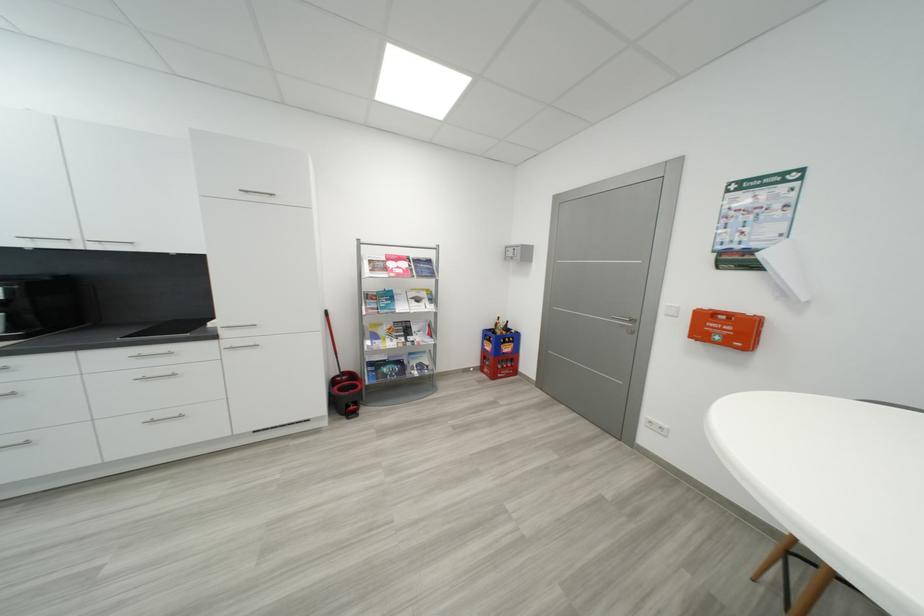
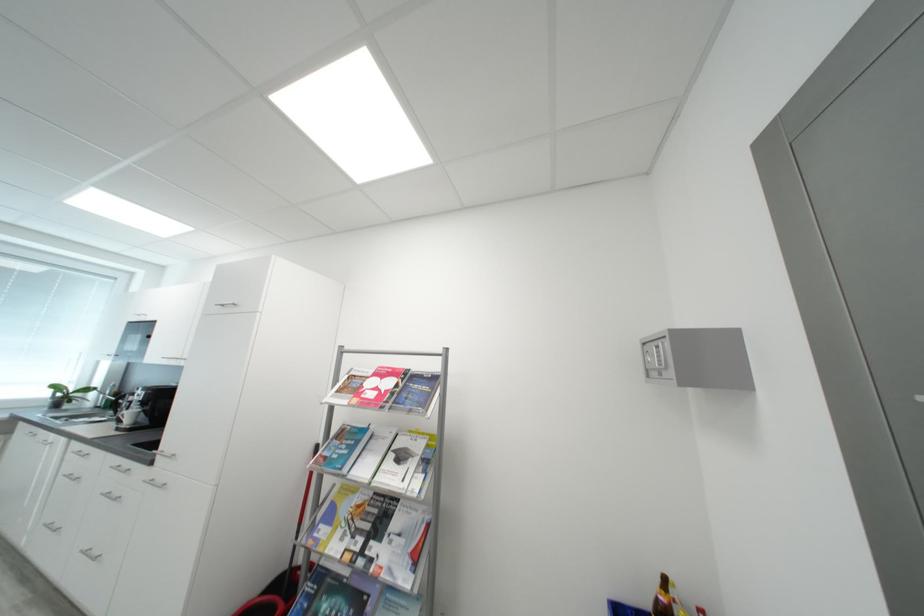
Locate, in the second image, the point that corresponds to point (253, 193) in the first image.

(228, 307)